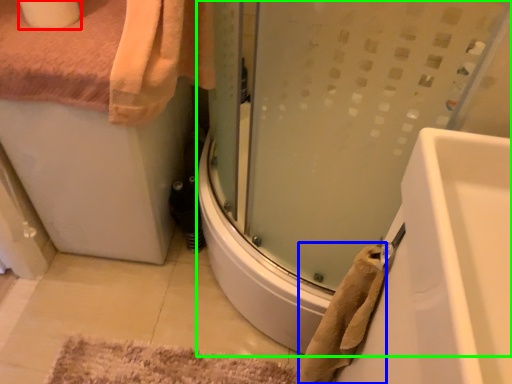
Question: Estimate the real-world distances between objects in this image. Which object is farther from toilet paper (highlighted by a red box), bath towel (highlighted by a blue box) or shower door (highlighted by a green box)?

Choices:
 (A) bath towel
 (B) shower door

Answer: (A)